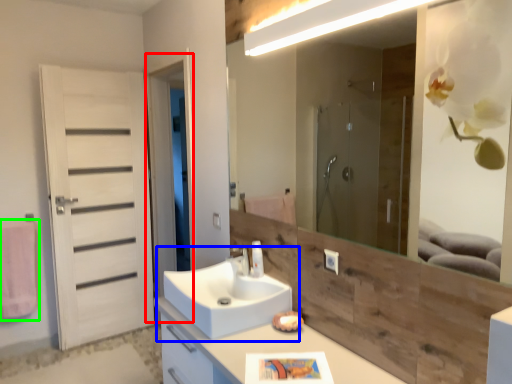
Question: Based on their relative distances, which object is nearer to screen door (highlighted by a red box)? Choose from sink (highlighted by a blue box) and bath towel (highlighted by a green box).

Choices:
 (A) sink
 (B) bath towel

Answer: (B)